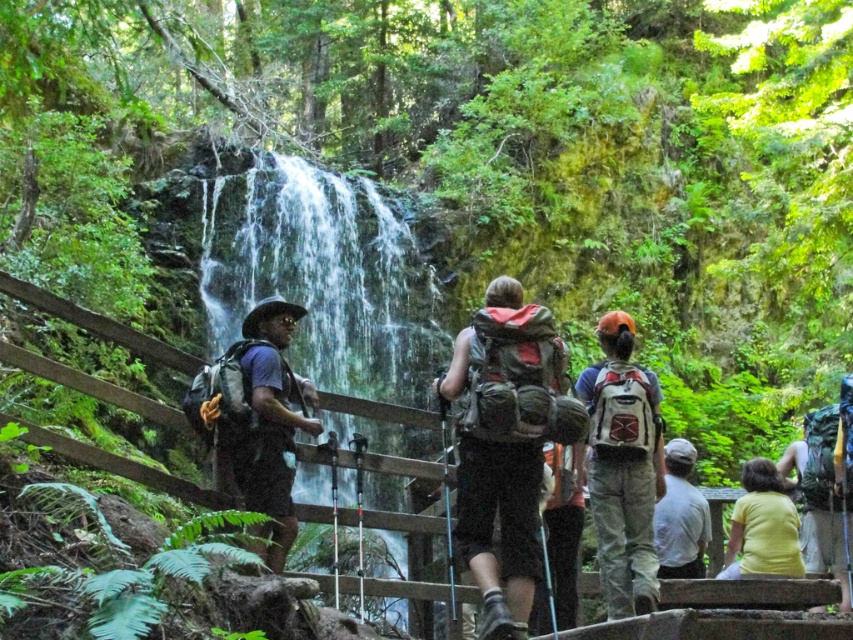
Describe the element at coordinates (506, 444) in the screenshot. Image resolution: width=853 pixels, height=640 pixels. I see `matte green backpack at center` at that location.

Who is positioned more to the left, matte green backpack at center or matte gray backpack at center?

From the viewer's perspective, matte green backpack at center appears more on the left side.

Identify the location of matte green backpack at center. The image size is (853, 640). (506, 444).

Locate an element on the screen. This screenshot has height=640, width=853. matte green backpack at center is located at coordinates (506, 444).

Measure the distance between matte gray backpack at center and camera.

28.04 meters

Which is more to the right, matte gray backpack at center or matte black backpack at left?

Positioned to the right is matte gray backpack at center.

Between point (618, 456) and point (267, 468), which one is positioned behind?

Point (618, 456)

Identify the location of matte gray backpack at center. This screenshot has height=640, width=853. (624, 468).

Between matte black backpack at left and gray fabric shirt at lower right, which one is positioned higher?

Positioned higher is matte black backpack at left.

Looking at this image, does matte black backpack at left have a lesser height compared to gray fabric shirt at lower right?

In fact, matte black backpack at left may be taller than gray fabric shirt at lower right.

What do you see at coordinates (270, 422) in the screenshot? Image resolution: width=853 pixels, height=640 pixels. I see `matte black backpack at left` at bounding box center [270, 422].

The height and width of the screenshot is (640, 853). In order to click on matte black backpack at left in this screenshot , I will do (x=270, y=422).